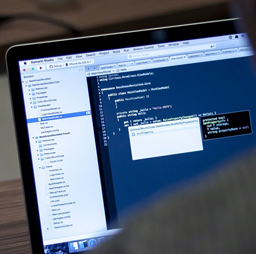
You are a GUI agent. You are given a task and a screenshot of the screen. Output one action in this format:
    pyautogui.click(x=<x>, y=<y>)
    Task: Click on the computer cord
    
    Given the screenshot: What is the action you would take?
    pyautogui.click(x=57, y=21)